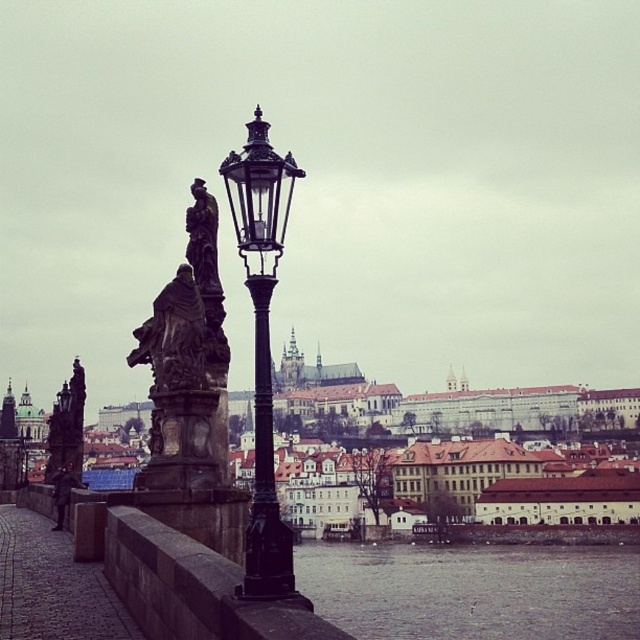
Who is lower down, bronze statue at left or dark brown stone statue at center?

bronze statue at left is below.

Which is in front, point (76, 408) or point (189, 216)?

Point (189, 216)

This screenshot has width=640, height=640. Describe the element at coordinates (67, 426) in the screenshot. I see `bronze statue at left` at that location.

I want to click on bronze statue at left, so click(x=67, y=426).

Does gray water at lower center have a lesser height compared to black metal street light at center?

Yes.

From the picture: Is gray water at lower center smaller than black metal street light at center?

Yes.

Who is more forward, (342,593) or (260,376)?

Point (260,376) is in front.

Locate an element on the screen. The image size is (640, 640). gray water at lower center is located at coordinates (472, 589).

Consider the image. Does black metal pole at center have a larger size compared to dark brown stone statue at center?

Yes.

Is black metal pole at center taller than dark brown stone statue at center?

A: Indeed, black metal pole at center has a greater height compared to dark brown stone statue at center.

Is point (266, 276) closer to camera compared to point (204, 262)?

Yes, point (266, 276) is closer to viewer.

Where is `black metal pole at center`? Image resolution: width=640 pixels, height=640 pixels. black metal pole at center is located at coordinates (264, 472).